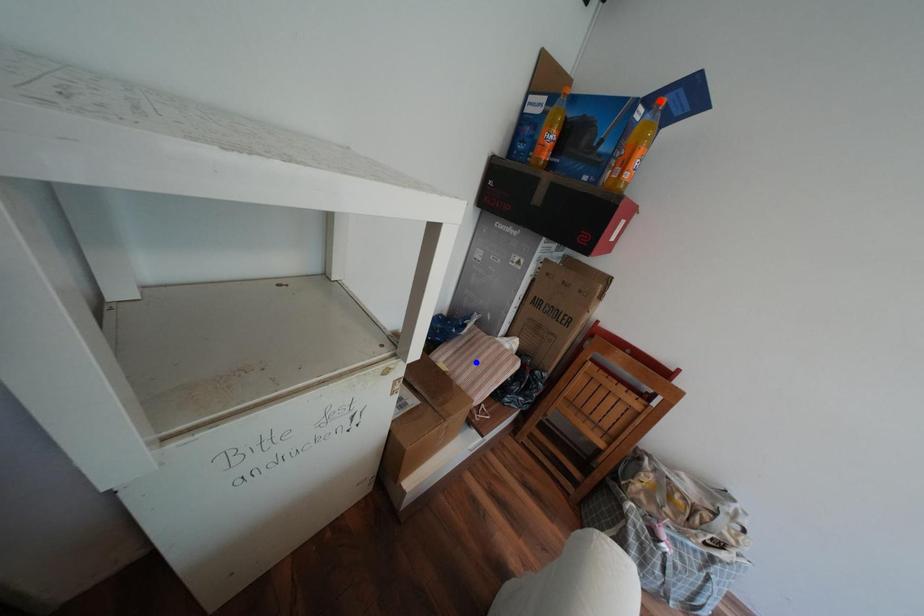
Question: Which of the two points in the image is closer to the camera?

Choices:
 (A) Blue point is closer.
 (B) Red point is closer.

Answer: (B)